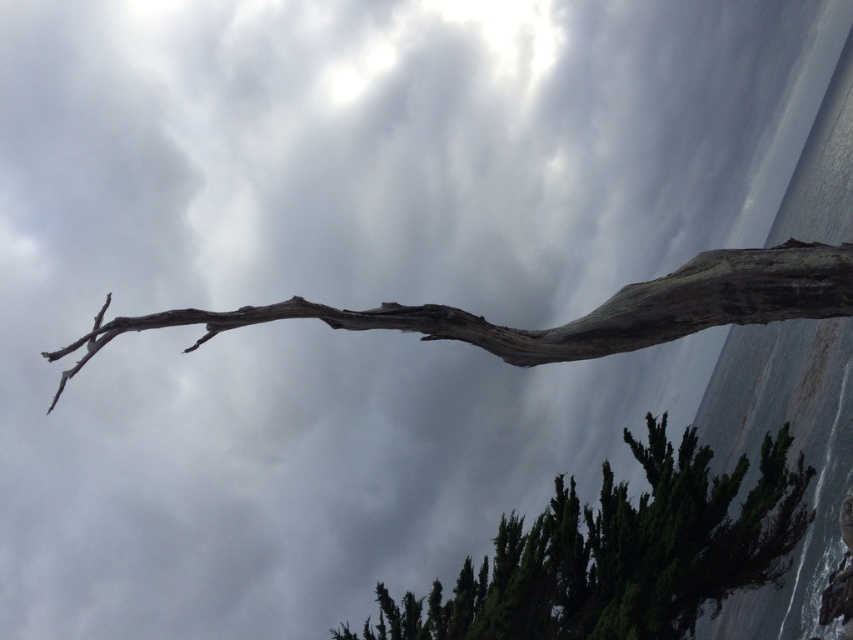
Question: Does dark green leafy tree at lower right appear under gray rough bark branch at upper center?

Choices:
 (A) no
 (B) yes

Answer: (B)

Question: Is dark green leafy tree at lower right bigger than gray rough bark branch at upper center?

Choices:
 (A) no
 (B) yes

Answer: (A)

Question: Is dark green leafy tree at lower right positioned before gray rough bark branch at upper center?

Choices:
 (A) no
 (B) yes

Answer: (A)